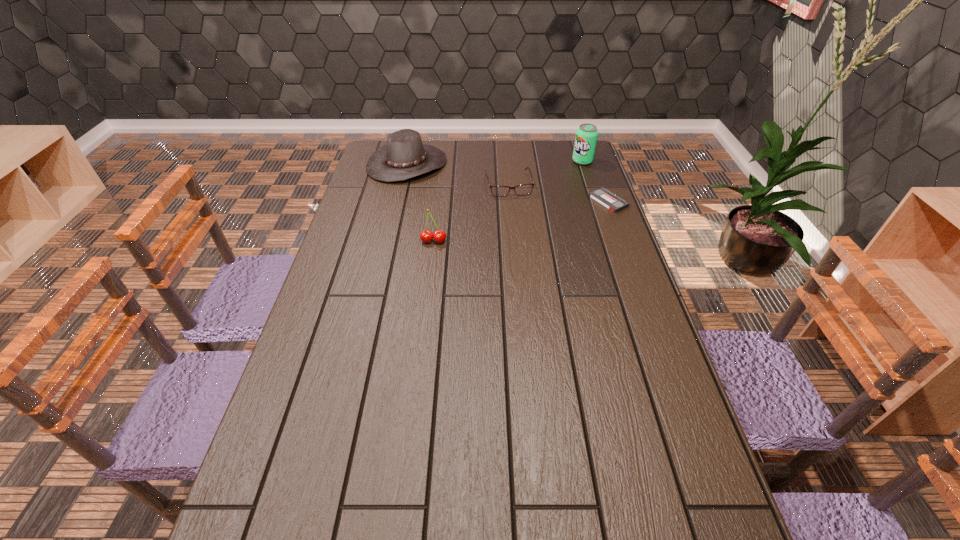
I want to click on videotape located in the right edge section of the desktop, so click(x=614, y=203).

Image resolution: width=960 pixels, height=540 pixels. Find the location of `pop soda present at the right edge`. pop soda present at the right edge is located at coordinates (586, 135).

Find the location of `object located in the far left corner section of the desktop`. object located in the far left corner section of the desktop is located at coordinates (404, 156).

Identify the location of object that is at the far right corner. Image resolution: width=960 pixels, height=540 pixels. (586, 135).

Locate an element on the screen. vacant point at the far edge is located at coordinates (492, 146).

Where is `free space at the near edge of the desktop`? This screenshot has width=960, height=540. free space at the near edge of the desktop is located at coordinates [x=542, y=498].

In the image, there is a desktop. Where is `vacant space at the left edge`? vacant space at the left edge is located at coordinates (349, 256).

This screenshot has width=960, height=540. I want to click on free point at the right edge, so click(628, 315).

Where is `free area in between the hat and the nearest object`? free area in between the hat and the nearest object is located at coordinates (420, 202).

You are a GUI agent. You are given a task and a screenshot of the screen. Output one action in this format:
    pyautogui.click(x=<x>, y=<y>)
    Task: Click on the vacant space in between the hat and the pop soda
    
    Given the screenshot: What is the action you would take?
    pyautogui.click(x=494, y=163)